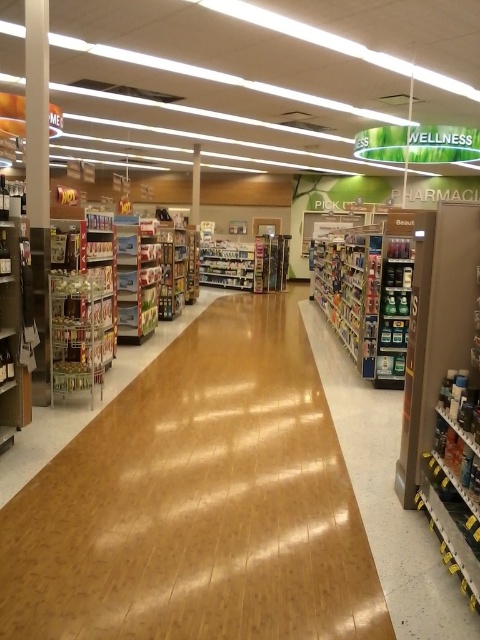
Question: Which point appears farthest from the camera in this image?

Choices:
 (A) (133, 340)
 (B) (40, 552)

Answer: (A)

Question: Among these points, which one is farthest from the camera?

Choices:
 (A) (60, 337)
 (B) (316, 476)
 (C) (157, 300)

Answer: (C)

Question: Which of the following is the closest to the observer?

Choices:
 (A) (66, 230)
 (B) (387, 627)

Answer: (B)

Question: Can you confirm if wooden floor at center is bigger than metallic silver shelves at left?

Choices:
 (A) yes
 (B) no

Answer: (B)

Question: Does metallic silver shelves at left appear over matte plastic shelves at left?

Choices:
 (A) yes
 (B) no

Answer: (B)

Question: Is wooden floor at center bigger than matte plastic shelves at left?

Choices:
 (A) yes
 (B) no

Answer: (B)